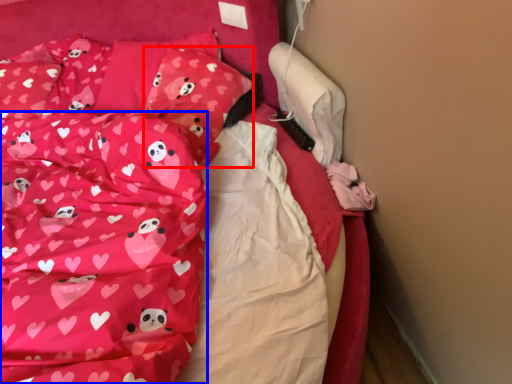
Question: Which object appears farthest to the camera in this image, pillow (highlighted by a red box) or blanket (highlighted by a blue box)?

Choices:
 (A) pillow
 (B) blanket

Answer: (A)